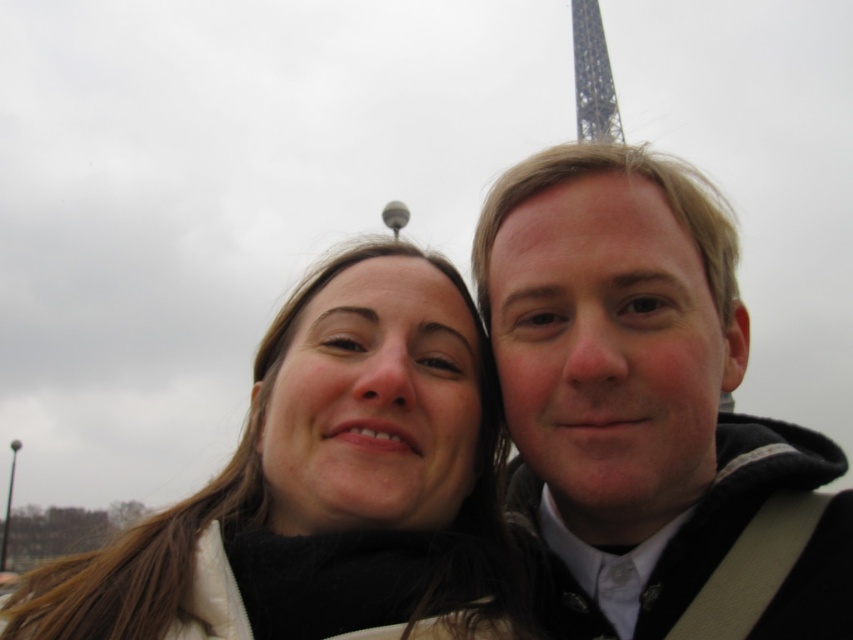
You are a photographer trying to capture a photo of the Eiffel Tower. You notice the smooth black jacket at right and the metallic lattice structure at upper center in your frame. Which object is positioned higher in the image?

The smooth black jacket at right is taller than the metallic lattice structure at upper center, so it is positioned higher in the image.

You are a photographer standing at the location where the selfie was taken. You want to capture a new photo that includes both the smooth black jacket at right and the metallic lattice structure at upper center. Given the current distance between them, will you need to zoom in or zoom out to ensure both subjects are fully visible in the frame?

The distance between the smooth black jacket at right and the metallic lattice structure at upper center is 53.09 meters. To include both subjects in the frame, you would need to zoom out to widen the field of view, allowing both the jacket and the lattice structure to be captured within the photo.